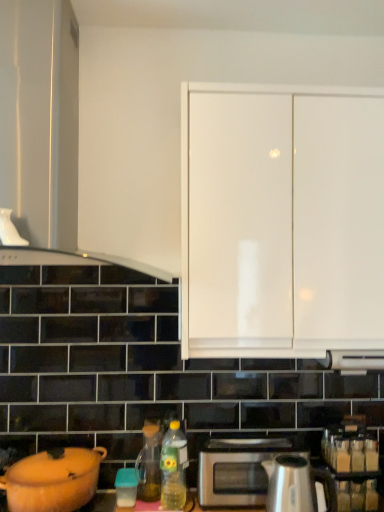
Identify the location of white glossy cabinet doors at upper center, acting as the second cabinetry starting from the left. This screenshot has height=512, width=384. (282, 224).

At what (x,y) coordinates should I click in order to perform the action: click on green plastic bottle at lower center. Please return your answer as a coordinate pair (x, y). The height and width of the screenshot is (512, 384). Looking at the image, I should click on (173, 468).

Describe the element at coordinates (53, 480) in the screenshot. This screenshot has width=384, height=512. I see `matte orange pot at lower left, acting as the 1th kitchen appliance starting from the left` at that location.

The height and width of the screenshot is (512, 384). In order to click on polished stainless steel kettle at lower center, arranged as the second kitchen appliance when viewed from the left in this screenshot , I will do `click(290, 484)`.

Where is `matte glass tea pot at lower center`? This screenshot has height=512, width=384. matte glass tea pot at lower center is located at coordinates (149, 464).

From a real-world perspective, is matte glass tea pot at lower center over green plastic bottle at lower center?

Incorrect, from a real-world perspective, matte glass tea pot at lower center is lower than green plastic bottle at lower center.

Considering the relative positions of matte glass tea pot at lower center and green plastic bottle at lower center in the image provided, is matte glass tea pot at lower center to the left of green plastic bottle at lower center from the viewer's perspective?

Yes.

Which is farther from the camera, (x=17, y=194) or (x=98, y=456)?

Positioned behind is point (x=98, y=456).

Can you confirm if white glossy cabinet at upper left, which appears as the second cabinetry when viewed from the right, is shorter than matte orange pot at lower left, acting as the 1th kitchen appliance starting from the left?

Incorrect, the height of white glossy cabinet at upper left, which appears as the second cabinetry when viewed from the right, does not fall short of that of matte orange pot at lower left, acting as the 1th kitchen appliance starting from the left.

Is matte orange pot at lower left, the second kitchen appliance in the right-to-left sequence, at the back of white glossy cabinet at upper left, which appears as the second cabinetry when viewed from the right?

No, matte orange pot at lower left, the second kitchen appliance in the right-to-left sequence, is not at the back of white glossy cabinet at upper left, which appears as the second cabinetry when viewed from the right.

Is white glossy cabinet at upper left, which appears as the second cabinetry when viewed from the right, at the right side of matte orange pot at lower left, acting as the 1th kitchen appliance starting from the left?

Indeed, white glossy cabinet at upper left, which appears as the second cabinetry when viewed from the right, is positioned on the right side of matte orange pot at lower left, acting as the 1th kitchen appliance starting from the left.

Which of these two, satin silver microwave at lower center or green plastic bottle at lower center, is smaller?

With smaller size is green plastic bottle at lower center.

Is satin silver microwave at lower center not near green plastic bottle at lower center?

No, satin silver microwave at lower center is in close proximity to green plastic bottle at lower center.

Does satin silver microwave at lower center appear on the left side of green plastic bottle at lower center?

Incorrect, satin silver microwave at lower center is not on the left side of green plastic bottle at lower center.

Between green plastic bottle at lower center and white glossy cabinet at upper left, which appears as the second cabinetry when viewed from the right, which one has less height?

With less height is green plastic bottle at lower center.

Locate an element on the screen. The height and width of the screenshot is (512, 384). cabinetry that is the 2nd object located above the green plastic bottle at lower center (from the image's perspective) is located at coordinates pyautogui.click(x=40, y=120).

Which is in front, point (182, 486) or point (65, 103)?

Point (182, 486)

Is green plastic bottle at lower center with white glossy cabinet at upper left, which is the 1th cabinetry from left to right?

No, green plastic bottle at lower center is not next to white glossy cabinet at upper left, which is the 1th cabinetry from left to right.

How far apart are white glossy cabinet doors at upper center, which is counted as the first cabinetry, starting from the right, and matte glass tea pot at lower center?

31.20 inches.

Between white glossy cabinet doors at upper center, acting as the second cabinetry starting from the left, and matte glass tea pot at lower center, which one has smaller width?

matte glass tea pot at lower center.

The height and width of the screenshot is (512, 384). In order to click on cabinetry that is the 1st object located in front of the matte glass tea pot at lower center in this screenshot , I will do `click(282, 224)`.

From a real-world perspective, who is located higher, white glossy cabinet doors at upper center, acting as the second cabinetry starting from the left, or matte glass tea pot at lower center?

In real-world perspective, white glossy cabinet doors at upper center, acting as the second cabinetry starting from the left, is above.

From their relative heights in the image, would you say green plastic bottle at lower center is taller or shorter than polished stainless steel kettle at lower center, which appears as the first kitchen appliance when viewed from the right?

green plastic bottle at lower center is taller than polished stainless steel kettle at lower center, which appears as the first kitchen appliance when viewed from the right.

Which is less distant, (x=181, y=438) or (x=274, y=470)?

The point (x=274, y=470) is closer.

From a real-world perspective, between green plastic bottle at lower center and polished stainless steel kettle at lower center, which appears as the first kitchen appliance when viewed from the right, who is vertically lower?

From a 3D spatial view, polished stainless steel kettle at lower center, which appears as the first kitchen appliance when viewed from the right, is below.

In terms of height, does polished stainless steel kettle at lower center, arranged as the second kitchen appliance when viewed from the left, look taller or shorter compared to matte orange pot at lower left, the second kitchen appliance in the right-to-left sequence?

polished stainless steel kettle at lower center, arranged as the second kitchen appliance when viewed from the left, is taller than matte orange pot at lower left, the second kitchen appliance in the right-to-left sequence.

Locate an element on the screen. kitchen appliance on the left of the polished stainless steel kettle at lower center, arranged as the second kitchen appliance when viewed from the left is located at coordinates (53, 480).

Is polished stainless steel kettle at lower center, arranged as the second kitchen appliance when viewed from the left, oriented away from matte orange pot at lower left, acting as the 1th kitchen appliance starting from the left?

polished stainless steel kettle at lower center, arranged as the second kitchen appliance when viewed from the left, is not turned away from matte orange pot at lower left, acting as the 1th kitchen appliance starting from the left.

Are polished stainless steel kettle at lower center, arranged as the second kitchen appliance when viewed from the left, and matte orange pot at lower left, acting as the 1th kitchen appliance starting from the left, located far from each other?

Actually, polished stainless steel kettle at lower center, arranged as the second kitchen appliance when viewed from the left, and matte orange pot at lower left, acting as the 1th kitchen appliance starting from the left, are a little close together.

Image resolution: width=384 pixels, height=512 pixels. Find the location of `tea pot behind the green plastic bottle at lower center`. tea pot behind the green plastic bottle at lower center is located at coordinates (149, 464).

From the image's perspective, starting from the white glossy cabinet at upper left, which is the 1th cabinetry from left to right, which kitchen appliance is the 1st one below? Please provide its 2D coordinates.

[(53, 480)]

Which object lies nearer to the anchor point matte glass tea pot at lower center, satin silver microwave at lower center or polished stainless steel kettle at lower center, which appears as the first kitchen appliance when viewed from the right?

satin silver microwave at lower center is positioned closer to the anchor matte glass tea pot at lower center.

Looking at the image, which one is located further to green plastic bottle at lower center, matte glass tea pot at lower center or matte orange pot at lower left, the second kitchen appliance in the right-to-left sequence?

Among the two, matte orange pot at lower left, the second kitchen appliance in the right-to-left sequence, is located further to green plastic bottle at lower center.

Considering their positions, is white glossy cabinet doors at upper center, acting as the second cabinetry starting from the left, positioned further to satin silver microwave at lower center than matte glass tea pot at lower center?

Based on the image, white glossy cabinet doors at upper center, acting as the second cabinetry starting from the left, appears to be further to satin silver microwave at lower center.

Based on their spatial positions, is matte glass tea pot at lower center or satin silver microwave at lower center closer to green plastic bottle at lower center?

Answer: matte glass tea pot at lower center lies closer to green plastic bottle at lower center than the other object.

Considering their positions, is matte glass tea pot at lower center positioned closer to polished stainless steel kettle at lower center, which appears as the first kitchen appliance when viewed from the right, than satin silver microwave at lower center?

Based on the image, satin silver microwave at lower center appears to be nearer to polished stainless steel kettle at lower center, which appears as the first kitchen appliance when viewed from the right.

Estimate the real-world distances between objects in this image. Which object is closer to green plastic bottle at lower center, polished stainless steel kettle at lower center, which appears as the first kitchen appliance when viewed from the right, or matte orange pot at lower left, the second kitchen appliance in the right-to-left sequence?

matte orange pot at lower left, the second kitchen appliance in the right-to-left sequence, lies closer to green plastic bottle at lower center than the other object.

Considering their positions, is green plastic bottle at lower center positioned further to matte orange pot at lower left, acting as the 1th kitchen appliance starting from the left, than polished stainless steel kettle at lower center, arranged as the second kitchen appliance when viewed from the left?

Based on the image, polished stainless steel kettle at lower center, arranged as the second kitchen appliance when viewed from the left, appears to be further to matte orange pot at lower left, acting as the 1th kitchen appliance starting from the left.

Considering their positions, is polished stainless steel kettle at lower center, which appears as the first kitchen appliance when viewed from the right, positioned closer to satin silver microwave at lower center than matte glass tea pot at lower center?

polished stainless steel kettle at lower center, which appears as the first kitchen appliance when viewed from the right, is closer to satin silver microwave at lower center.

Where is `cabinetry between white glossy cabinet at upper left, which appears as the second cabinetry when viewed from the right, and matte glass tea pot at lower center in the up-down direction`? This screenshot has height=512, width=384. cabinetry between white glossy cabinet at upper left, which appears as the second cabinetry when viewed from the right, and matte glass tea pot at lower center in the up-down direction is located at coordinates (282, 224).

You are a GUI agent. You are given a task and a screenshot of the screen. Output one action in this format:
    pyautogui.click(x=<x>, y=<y>)
    Task: Click on the bottle between white glossy cabinet doors at upper center, acting as the second cabinetry starting from the left, and polished stainless steel kettle at lower center, arranged as the second kitchen appliance when viewed from the left, vertically
    
    Given the screenshot: What is the action you would take?
    pyautogui.click(x=173, y=468)

This screenshot has height=512, width=384. Find the location of `cabinetry that lies between white glossy cabinet at upper left, which is the 1th cabinetry from left to right, and matte orange pot at lower left, the second kitchen appliance in the right-to-left sequence, from top to bottom`. cabinetry that lies between white glossy cabinet at upper left, which is the 1th cabinetry from left to right, and matte orange pot at lower left, the second kitchen appliance in the right-to-left sequence, from top to bottom is located at coordinates (282, 224).

You are a GUI agent. You are given a task and a screenshot of the screen. Output one action in this format:
    pyautogui.click(x=<x>, y=<y>)
    Task: Click on the tea pot situated between matte orange pot at lower left, acting as the 1th kitchen appliance starting from the left, and polished stainless steel kettle at lower center, which appears as the first kitchen appliance when viewed from the right, from left to right
    Image resolution: width=384 pixels, height=512 pixels.
    Given the screenshot: What is the action you would take?
    pyautogui.click(x=149, y=464)